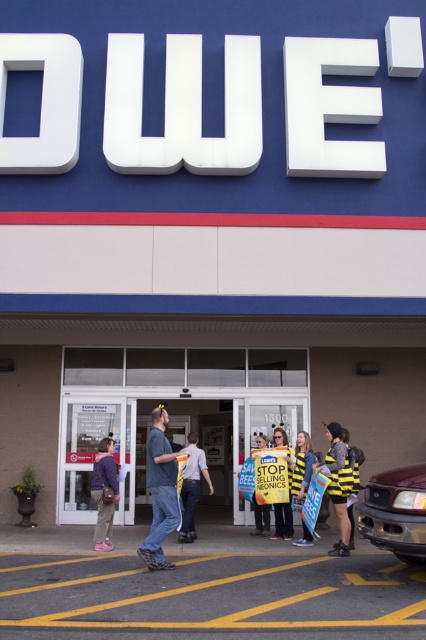
Does matte red truck at lower right have a greater width compared to bee costume at center?

Indeed, matte red truck at lower right has a greater width compared to bee costume at center.

Is matte red truck at lower right bigger than bee costume at center?

Yes, matte red truck at lower right is bigger than bee costume at center.

Locate an element on the screen. The height and width of the screenshot is (640, 426). matte red truck at lower right is located at coordinates (396, 512).

Image resolution: width=426 pixels, height=640 pixels. What are the coordinates of `matte red truck at lower right` in the screenshot? It's located at (396, 512).

Consider the image. Who is more forward, (146, 472) or (294, 474)?

Positioned in front is point (146, 472).

In the scene shown: Is denim jeans at center smaller than bee costume at center?

No, denim jeans at center is not smaller than bee costume at center.

What do you see at coordinates (161, 490) in the screenshot? I see `denim jeans at center` at bounding box center [161, 490].

The height and width of the screenshot is (640, 426). I want to click on denim jeans at center, so click(161, 490).

The image size is (426, 640). What do you see at coordinates (161, 490) in the screenshot? I see `denim jeans at center` at bounding box center [161, 490].

Is denim jeans at center shorter than yellow bee-patterned vest at center?

Incorrect, denim jeans at center's height does not fall short of yellow bee-patterned vest at center's.

Which is behind, point (155, 442) or point (288, 461)?

The point (288, 461) is behind.

Identify the location of denim jeans at center. The image size is (426, 640). [x=161, y=490].